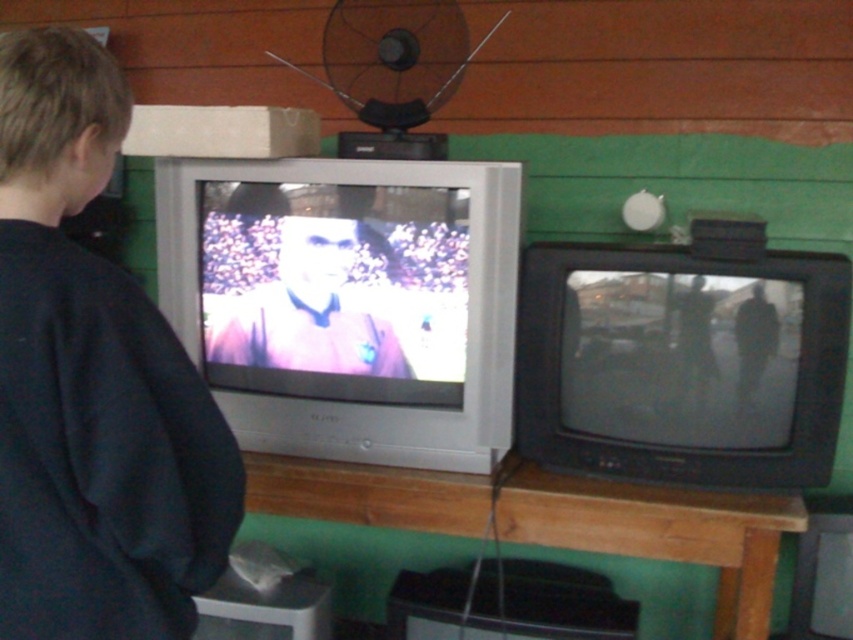
Question: Can you confirm if dark blue sweatshirt at left is positioned to the left of matte black shirt at center?

Choices:
 (A) no
 (B) yes

Answer: (B)

Question: Does dark blue sweatshirt at left come behind matte black shirt at center?

Choices:
 (A) no
 (B) yes

Answer: (A)

Question: Which point appears closest to the camera in this image?

Choices:
 (A) (357, 236)
 (B) (28, 618)

Answer: (B)

Question: Which object appears farthest from the camera in this image?

Choices:
 (A) matte black shirt at center
 (B) dark blue sweatshirt at left

Answer: (A)

Question: Does dark blue sweatshirt at left appear on the left side of matte black shirt at center?

Choices:
 (A) no
 (B) yes

Answer: (B)

Question: Which of the following is the farthest from the observer?

Choices:
 (A) (251, 355)
 (B) (161, 598)

Answer: (A)